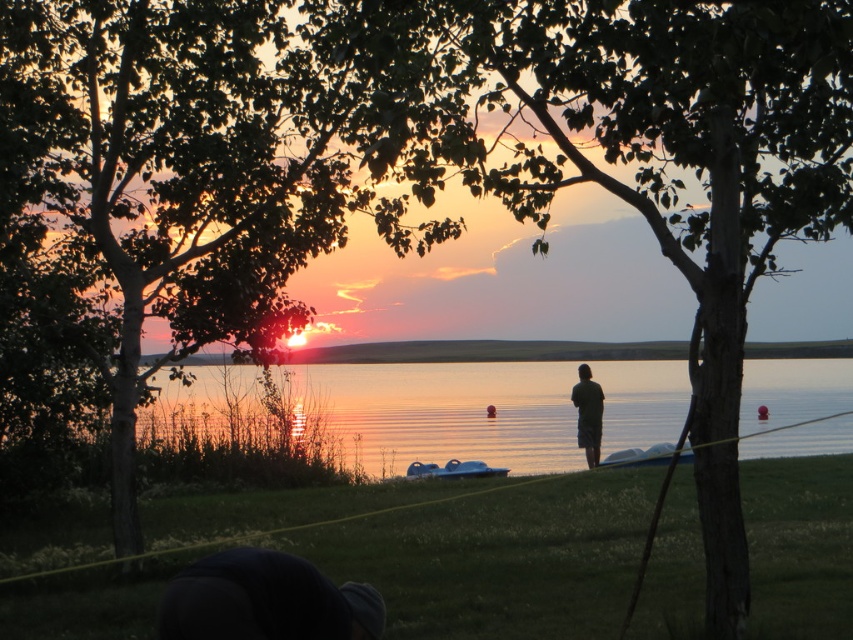
Question: Which point is closer to the camera?

Choices:
 (A) (97, 406)
 (B) (386, 472)
 (C) (583, 392)
 (D) (734, 138)

Answer: (D)

Question: Does green leafy tree at upper left appear on the left side of dark green fabric at center?

Choices:
 (A) yes
 (B) no

Answer: (A)

Question: Is the position of reflective glass water at center more distant than that of blue rubber boat at center?

Choices:
 (A) no
 (B) yes

Answer: (A)

Question: Is reflective glass water at center thinner than dark green fabric at center?

Choices:
 (A) no
 (B) yes

Answer: (A)

Question: Among these objects, which one is nearest to the camera?

Choices:
 (A) green leafy tree at center
 (B) green leafy tree at upper left
 (C) dark green fabric at center
 (D) blue rubber boat at center

Answer: (A)

Question: Which point appears farthest from the camera in this image?

Choices:
 (A) (503, 468)
 (B) (49, 212)

Answer: (A)